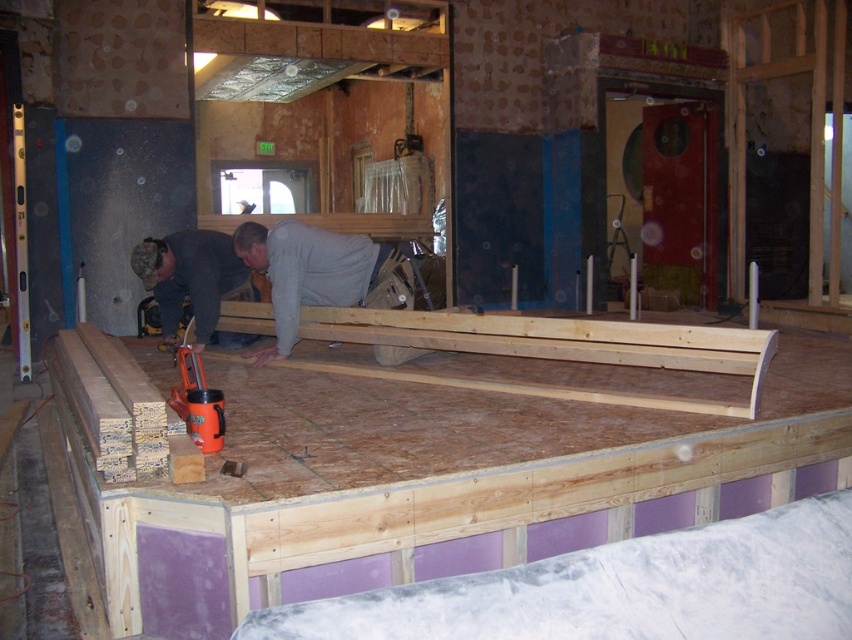
Question: Which point is farther from the camera taking this photo?

Choices:
 (A) (392, 390)
 (B) (223, 259)

Answer: (B)

Question: Which point is farther to the camera?

Choices:
 (A) (275, 269)
 (B) (251, 284)

Answer: (B)

Question: Which point is closer to the camera?

Choices:
 (A) camouflage fabric shirt at center
 (B) natural wood workbench at center
 (C) gray matte shirt at center

Answer: (B)

Question: Does natural wood workbench at center have a lesser width compared to gray matte shirt at center?

Choices:
 (A) no
 (B) yes

Answer: (A)

Question: Can you confirm if gray matte shirt at center is wider than camouflage fabric shirt at center?

Choices:
 (A) yes
 (B) no

Answer: (A)

Question: Does natural wood workbench at center have a greater width compared to gray matte shirt at center?

Choices:
 (A) yes
 (B) no

Answer: (A)